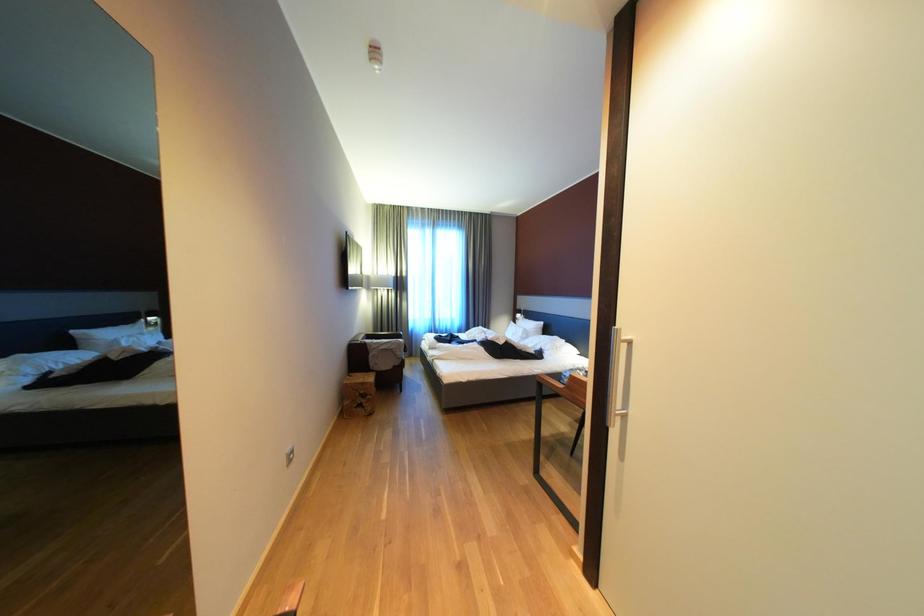
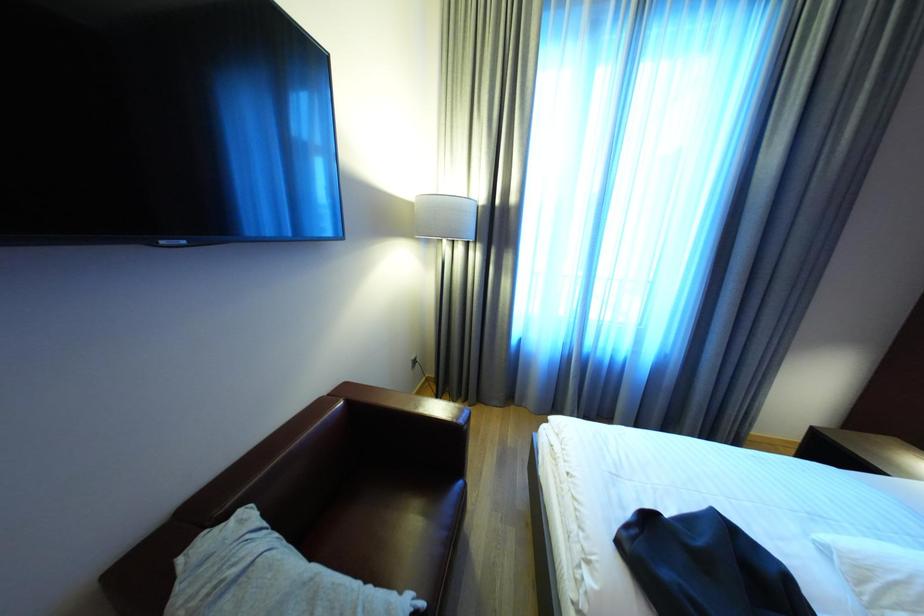
Question: What movement of the cameraman would produce the second image?

Choices:
 (A) Left
 (B) Right
 (C) Forward
 (D) Backward

Answer: (C)